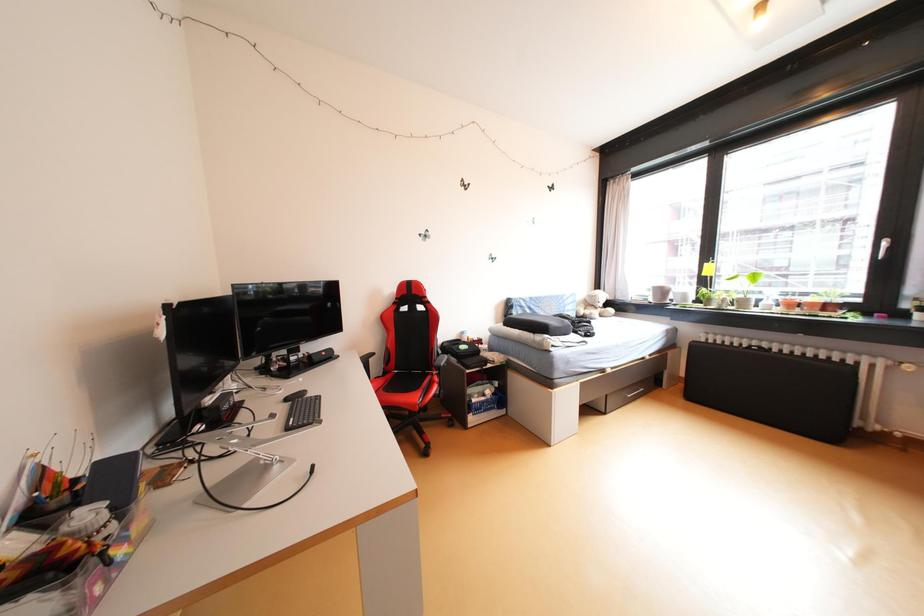
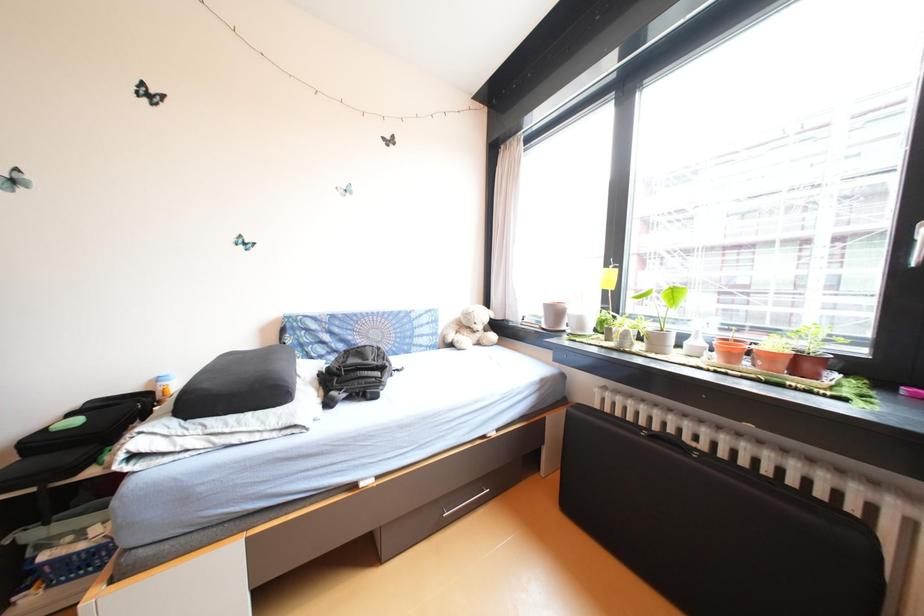
In a continuous first-person perspective shot, in which direction is the camera moving?

The cameraman walked toward right, forward.